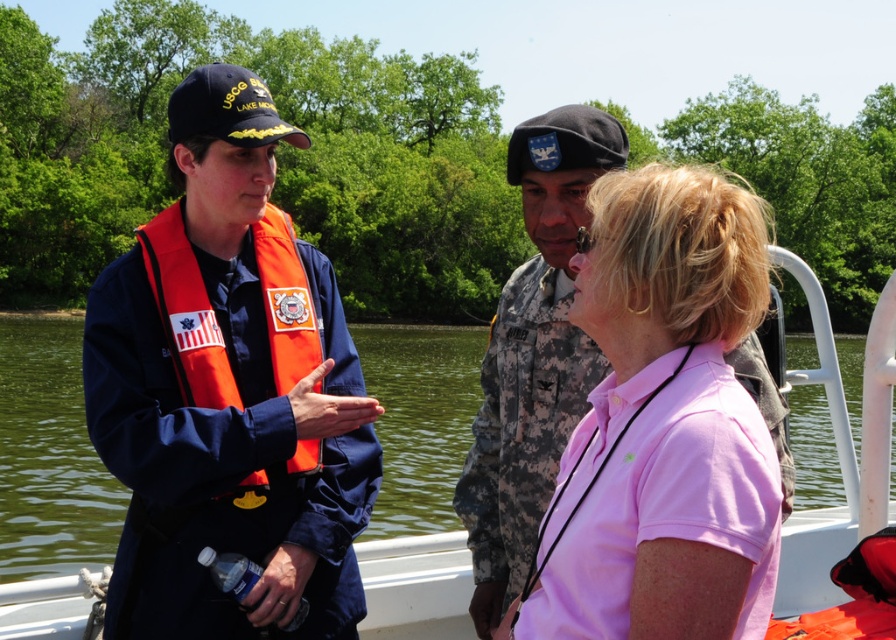
Does navy blue uniform at center have a lesser width compared to pink cotton polo shirt at center?

In fact, navy blue uniform at center might be wider than pink cotton polo shirt at center.

How distant is navy blue uniform at center from pink cotton polo shirt at center?

They are 4.21 feet apart.

Where is `navy blue uniform at center`? The image size is (896, 640). navy blue uniform at center is located at coordinates (228, 392).

Which of these two, navy blue uniform at center or orange fabric life jacket at left, stands shorter?

orange fabric life jacket at left

The height and width of the screenshot is (640, 896). I want to click on navy blue uniform at center, so 228,392.

Can you confirm if pink cotton polo shirt at center is thinner than orange fabric life jacket at left?

In fact, pink cotton polo shirt at center might be wider than orange fabric life jacket at left.

Does pink cotton polo shirt at center appear under orange fabric life jacket at left?

Indeed, pink cotton polo shirt at center is positioned under orange fabric life jacket at left.

Between point (537, 604) and point (192, 364), which one is positioned behind?

The point (192, 364) is behind.

At what (x,y) coordinates should I click in order to perform the action: click on pink cotton polo shirt at center. Please return your answer as a coordinate pair (x, y). This screenshot has height=640, width=896. Looking at the image, I should click on (664, 422).